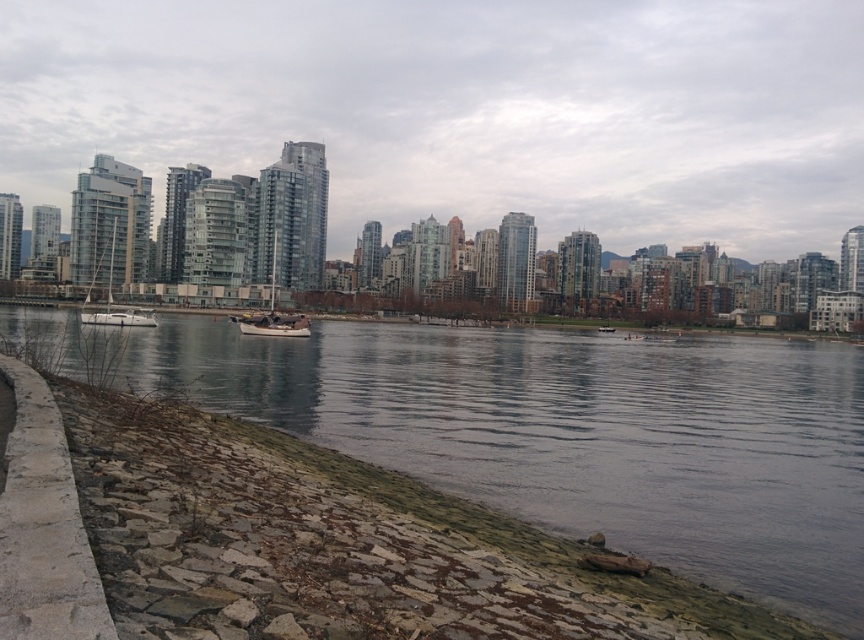
Between smooth concrete river at lower left and white glossy sailboat at left, which one appears on the left side from the viewer's perspective?

white glossy sailboat at left is more to the left.

Is point (843, 417) positioned in front of point (118, 316)?

Yes, point (843, 417) is in front of point (118, 316).

The height and width of the screenshot is (640, 864). Find the location of `smooth concrete river at lower left`. smooth concrete river at lower left is located at coordinates (581, 433).

Describe the element at coordinates (581, 433) in the screenshot. I see `smooth concrete river at lower left` at that location.

Which is below, smooth concrete river at lower left or wooden sailboat at center?

Positioned lower is smooth concrete river at lower left.

Does point (731, 509) come closer to viewer compared to point (272, 273)?

Yes.

At what (x,y) coordinates should I click in order to perform the action: click on smooth concrete river at lower left. Please return your answer as a coordinate pair (x, y). Image resolution: width=864 pixels, height=640 pixels. Looking at the image, I should click on (581, 433).

Does white glossy sailboat at left appear on the right side of wooden sailboat at center?

Incorrect, white glossy sailboat at left is not on the right side of wooden sailboat at center.

Between point (110, 253) and point (265, 321), which one is positioned in front?

Point (265, 321) is in front.

Who is more forward, (113,225) or (264,320)?

Point (264,320) is more forward.

You are a GUI agent. You are given a task and a screenshot of the screen. Output one action in this format:
    pyautogui.click(x=<x>, y=<y>)
    Task: Click on the white glossy sailboat at left
    This screenshot has width=864, height=640.
    Given the screenshot: What is the action you would take?
    pyautogui.click(x=113, y=301)